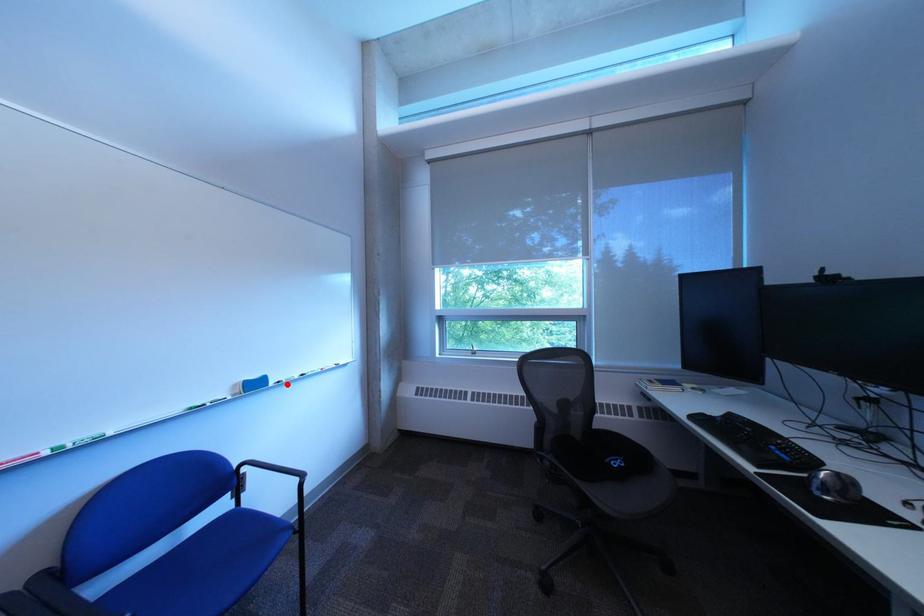
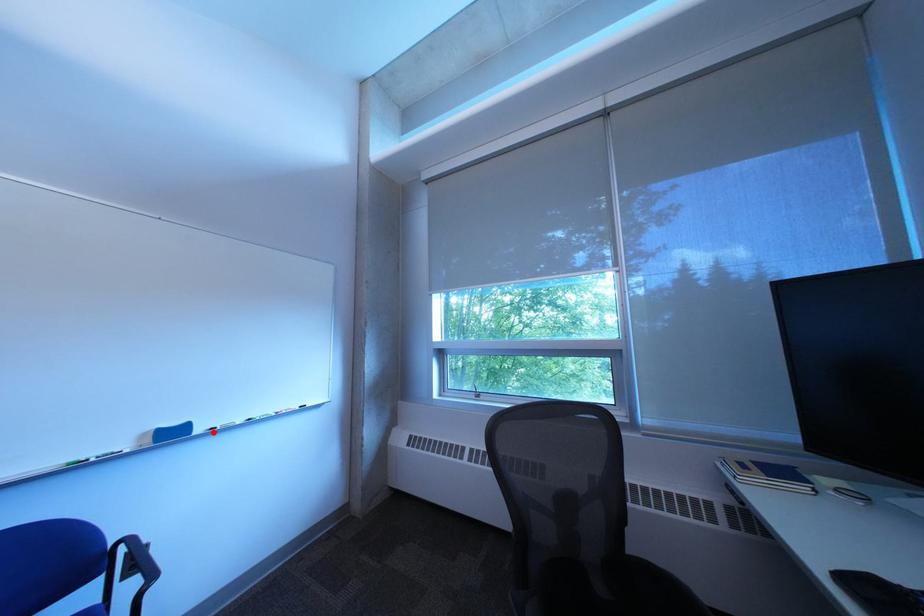
I am providing you with two images of the same scene from different viewpoints. A red point is marked on the first image and another point is marked on the second image. Are the points marked in image1 and image2 representing the same 3D position?

Yes